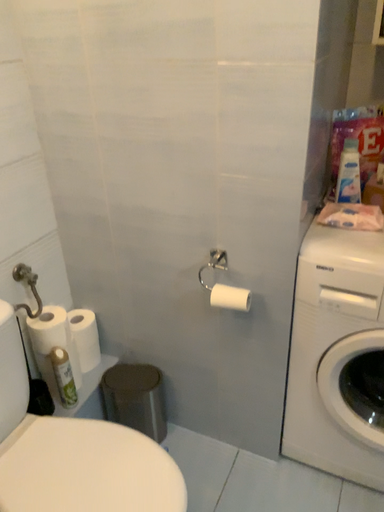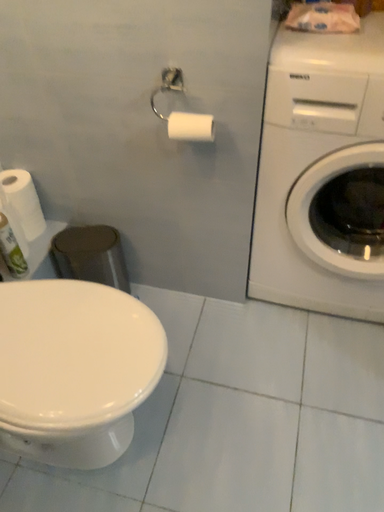
Question: Which way did the camera rotate in the video?

Choices:
 (A) rotated left
 (B) rotated right

Answer: (B)